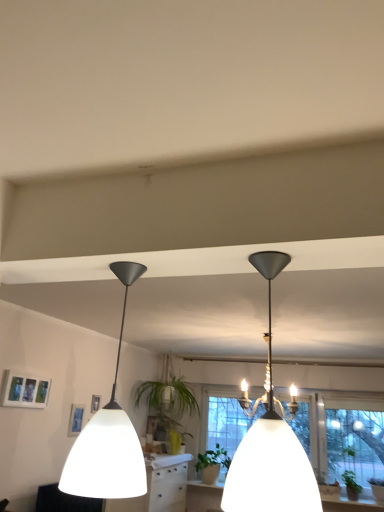
Question: Looking at their shapes, would you say matte black chandelier at upper center, the 1th lamp positioned from the right, is wider or thinner than matte black lampshade at left, the 2th lamp in the right-to-left sequence?

Choices:
 (A) wide
 (B) thin

Answer: (A)

Question: From a real-world perspective, is matte black chandelier at upper center, the 1th lamp positioned from the right, positioned above or below matte black lampshade at left, the first lamp when ordered from left to right?

Choices:
 (A) above
 (B) below

Answer: (A)

Question: Estimate the real-world distances between objects in this image. Which object is closer to the green matte plant at lower right, placed as the 2th plant when sorted from left to right?

Choices:
 (A) transparent glass window at center
 (B) green leafy plant at center
 (C) green matte plant at center, arranged as the first plant when viewed from the left
 (D) matte white picture frame at upper left
 (E) matte black chandelier at upper center, the 1th lamp positioned from the right

Answer: (A)

Question: Based on their relative distances, which object is nearer to the green matte plant at center, arranged as the first plant when viewed from the back?

Choices:
 (A) matte black lampshade at left, the 2th lamp in the right-to-left sequence
 (B) green matte plant at lower right, placed as the 2th plant when sorted from left to right
 (C) transparent glass window at center
 (D) matte white picture frame at upper left
 (E) green leafy plant at center

Answer: (E)